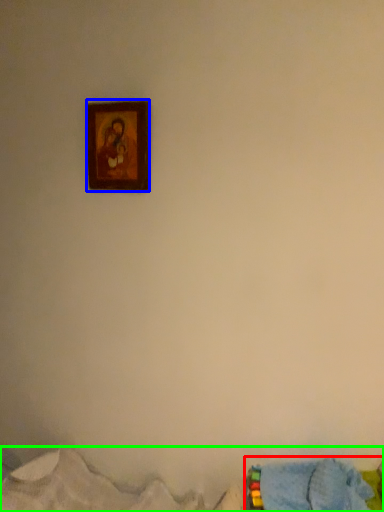
Question: Which object is positioned farthest from bed (highlighted by a red box)? Select from picture frame (highlighted by a blue box) and bed (highlighted by a green box).

Choices:
 (A) picture frame
 (B) bed

Answer: (A)